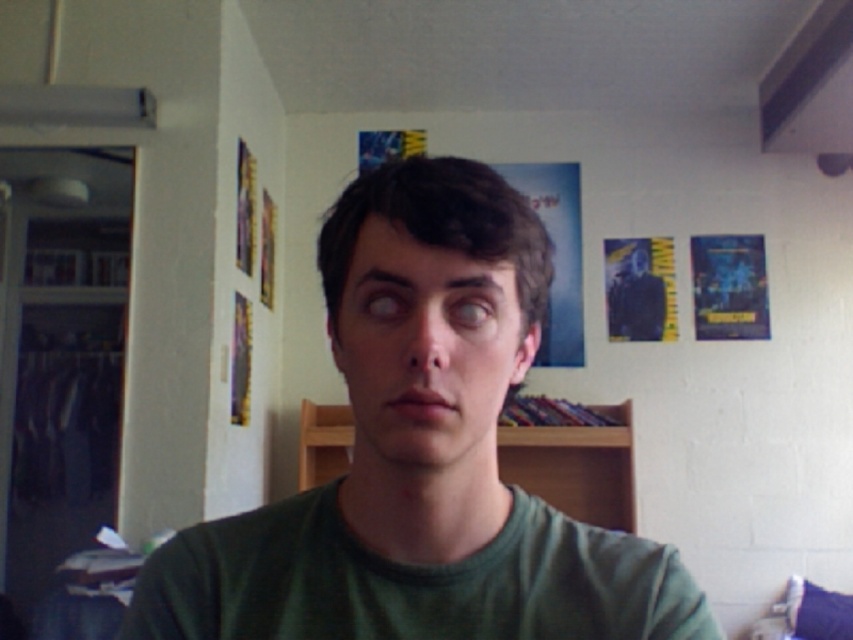
Question: Is green matte shirt at center above wooden bookshelf at center?

Choices:
 (A) no
 (B) yes

Answer: (B)

Question: Can you confirm if green matte shirt at center is positioned to the left of wooden bookshelf at center?

Choices:
 (A) yes
 (B) no

Answer: (A)

Question: Which point is closer to the camera?

Choices:
 (A) green matte shirt at center
 (B) wooden bookshelf at center

Answer: (A)

Question: Which point is closer to the camera?

Choices:
 (A) green matte shirt at center
 (B) wooden bookshelf at center

Answer: (A)

Question: Does green matte shirt at center appear on the left side of wooden bookshelf at center?

Choices:
 (A) no
 (B) yes

Answer: (B)

Question: Which object appears farthest from the camera in this image?

Choices:
 (A) green matte shirt at center
 (B) wooden bookshelf at center

Answer: (B)